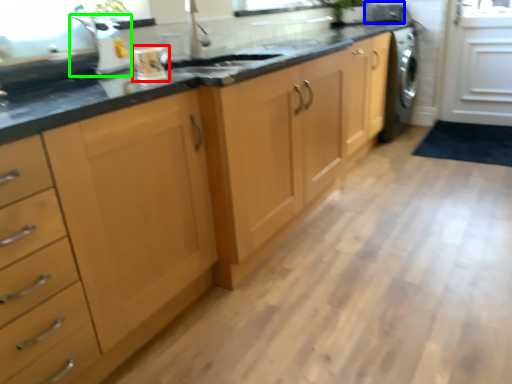
Question: Considering the real-world distances, which object is closest to kitchen appliance (highlighted by a red box)? appliance (highlighted by a blue box) or appliance (highlighted by a green box).

Choices:
 (A) appliance
 (B) appliance

Answer: (B)